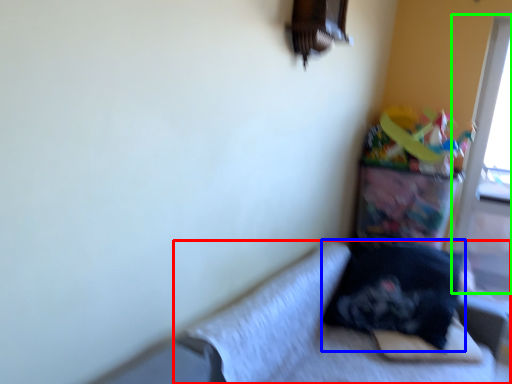
Question: Considering the real-world distances, which object is closest to studio couch (highlighted by a red box)? pillow (highlighted by a blue box) or screen door (highlighted by a green box).

Choices:
 (A) pillow
 (B) screen door

Answer: (A)